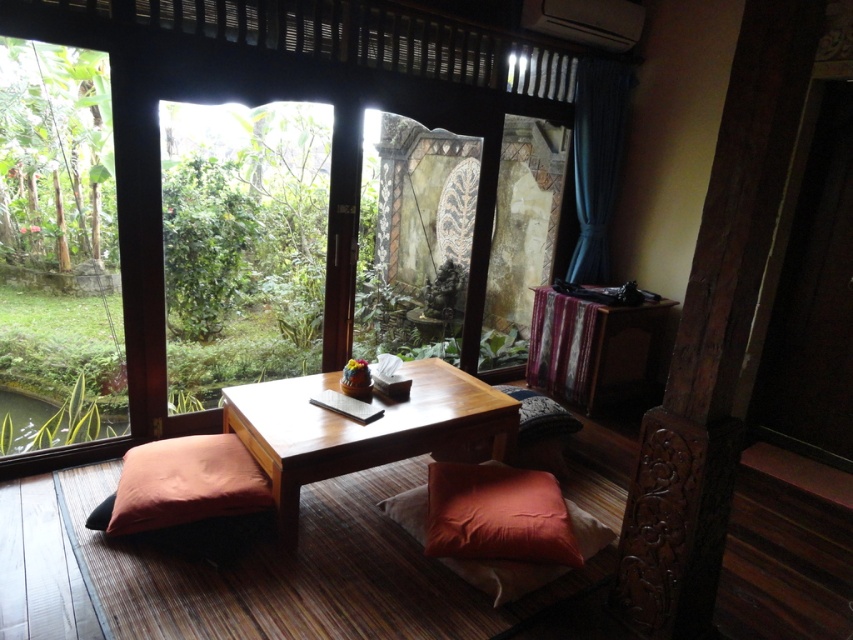
You are planning to place a large potted plant in the room. The wooden frame at center and wooden table at center are both potential spots. Considering their sizes, which object can accommodate the potted plant better?

The wooden frame at center has a larger size compared to wooden table at center, so it can accommodate the potted plant better.

You are standing in the room and want to take a photo of the point at coordinates (165, 93). Is this point within the camera frame? Please answer based on the distance from the camera.

The point at coordinates (165, 93) is 9.59 feet away from the camera. Assuming the camera has a standard field of view, this distance likely places the point within the frame as it is not excessively far. However, precise framing depends on the camera angle and zoom level.

You are a delivery person who needs to place a package on a surface in the room. You have a 4 feet long pole that you need to carry through the space. Is there enough space between the wooden frame at center and the wooden pad at center to move the pole without tilting it?

The wooden frame at center is 4.21 feet away from the wooden pad at center. Since the pole is 4 feet long, there is enough space to move it without tilting because the distance between the two objects is greater than the pole length.